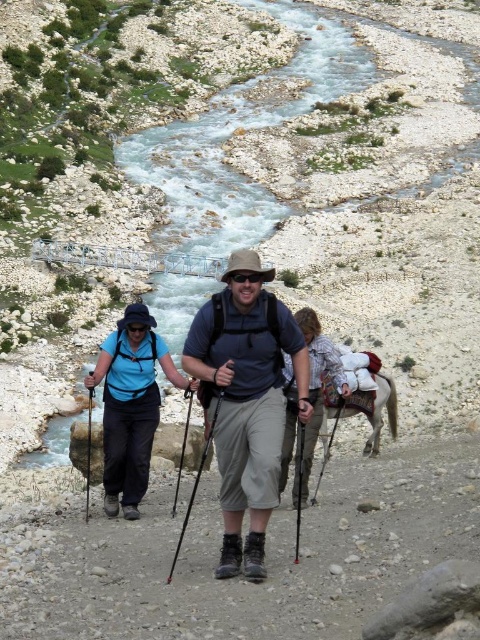
Question: Considering the real-world distances, which object is farthest from the gray fabric pants at center?

Choices:
 (A) light brown leather backpack at center
 (B) matte blue shirt at center
 (C) matte gray shorts at center

Answer: (A)

Question: Is matte blue shirt at center thinner than matte gray shorts at center?

Choices:
 (A) no
 (B) yes

Answer: (A)

Question: Which object appears farthest from the camera in this image?

Choices:
 (A) light brown leather backpack at center
 (B) matte gray shorts at center
 (C) gray fabric pants at center

Answer: (A)

Question: Is gray fabric pants at center below light brown leather backpack at center?

Choices:
 (A) yes
 (B) no

Answer: (A)

Question: Estimate the real-world distances between objects in this image. Which object is closer to the light brown leather backpack at center?

Choices:
 (A) matte blue shirt at center
 (B) matte gray shorts at center

Answer: (B)

Question: Is matte gray shorts at center below light brown leather backpack at center?

Choices:
 (A) no
 (B) yes

Answer: (A)